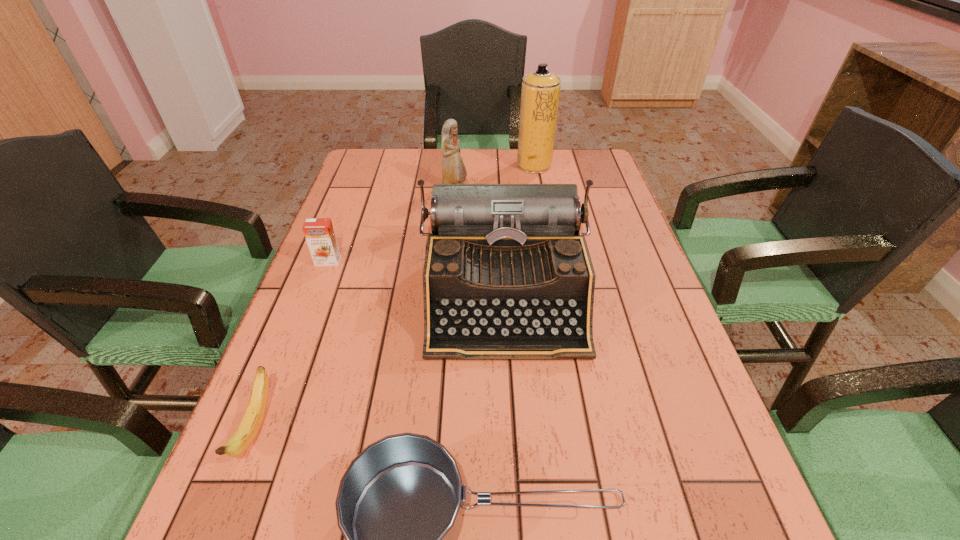
The image size is (960, 540). What are the coordinates of `the farthest object` in the screenshot? It's located at (540, 91).

Identify the location of aerosol can. (540, 91).

Find the location of a particular element. the fifth nearest object is located at coordinates (453, 169).

Locate an element on the screen. The width and height of the screenshot is (960, 540). typewriter is located at coordinates (507, 275).

You are a GUI agent. You are given a task and a screenshot of the screen. Output one action in this format:
    pyautogui.click(x=<x>, y=<y>)
    Task: Click on the third shortest object
    
    Given the screenshot: What is the action you would take?
    pyautogui.click(x=319, y=233)

Where is `banana`? This screenshot has width=960, height=540. banana is located at coordinates (249, 427).

Locate an element on the screen. This screenshot has height=540, width=960. vacant space located 0.360m on the front of the farthest object is located at coordinates (548, 242).

At what (x,y) coordinates should I click in order to perform the action: click on vacant space located on the front-facing side of the figurine. Please return your answer as a coordinate pair (x, y). The width and height of the screenshot is (960, 540). Looking at the image, I should click on (586, 188).

Find the location of `free spot located 0.130m on the keyboard of the typewriter`. free spot located 0.130m on the keyboard of the typewriter is located at coordinates click(513, 422).

The width and height of the screenshot is (960, 540). In order to click on free region located 0.160m on the right of the fourth tallest object in this screenshot , I will do `click(402, 261)`.